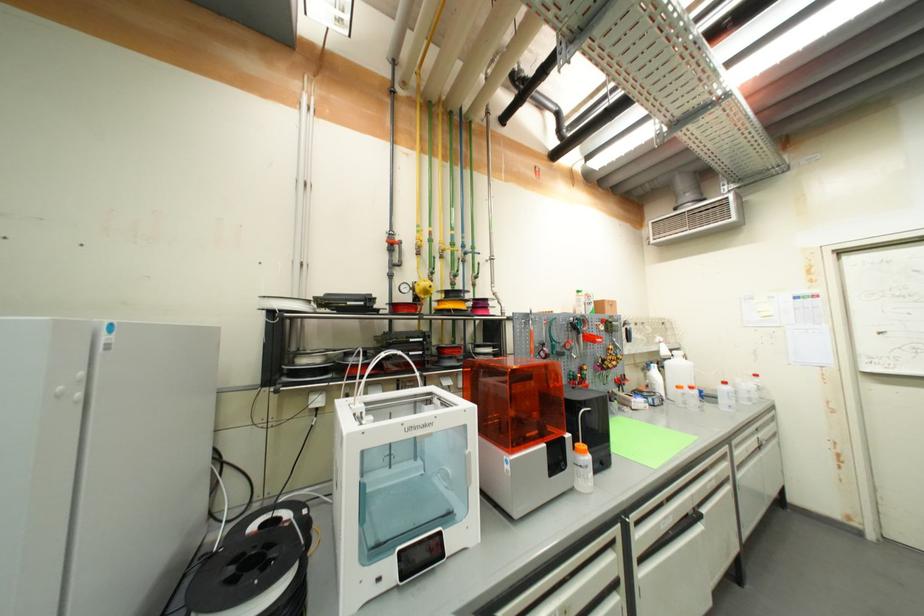
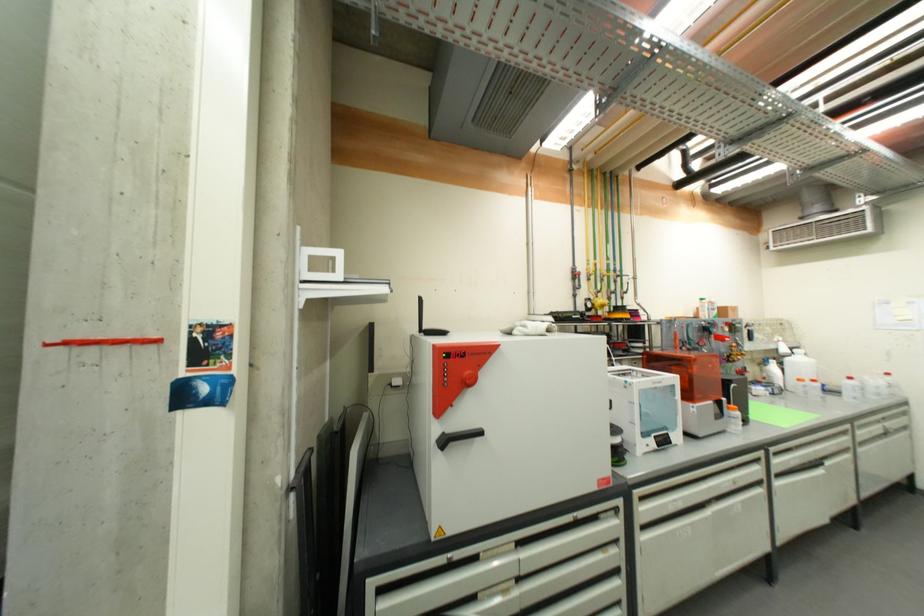
Question: I am providing you with two images of the same scene from different viewpoints. Please identify which objects are invisible in image2.

Choices:
 (A) small spray bottle
 (B) red control dial
 (C) black oven handle
 (D) none of these

Answer: (D)